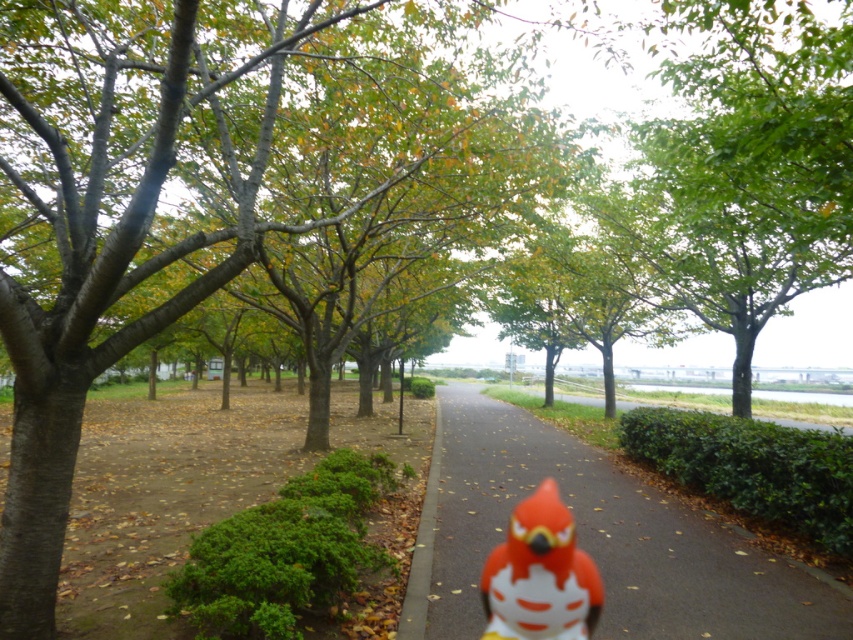
Question: Among these points, which one is nearest to the camera?

Choices:
 (A) 544,634
 (B) 447,516

Answer: (A)

Question: Can you confirm if smooth asphalt path at center is smaller than matte orange bird at center?

Choices:
 (A) yes
 (B) no

Answer: (B)

Question: Can you confirm if smooth asphalt path at center is positioned above matte orange bird at center?

Choices:
 (A) yes
 (B) no

Answer: (B)

Question: Is smooth asphalt path at center to the right of matte orange bird at center from the viewer's perspective?

Choices:
 (A) no
 (B) yes

Answer: (B)